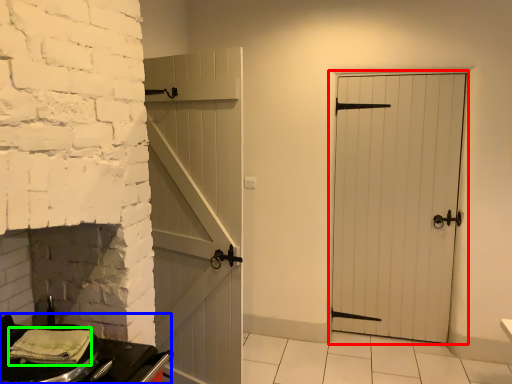
Question: Estimate the real-world distances between objects in this image. Which object is farther from door (highlighted by a red box), table (highlighted by a blue box) or material (highlighted by a green box)?

Choices:
 (A) table
 (B) material

Answer: (B)